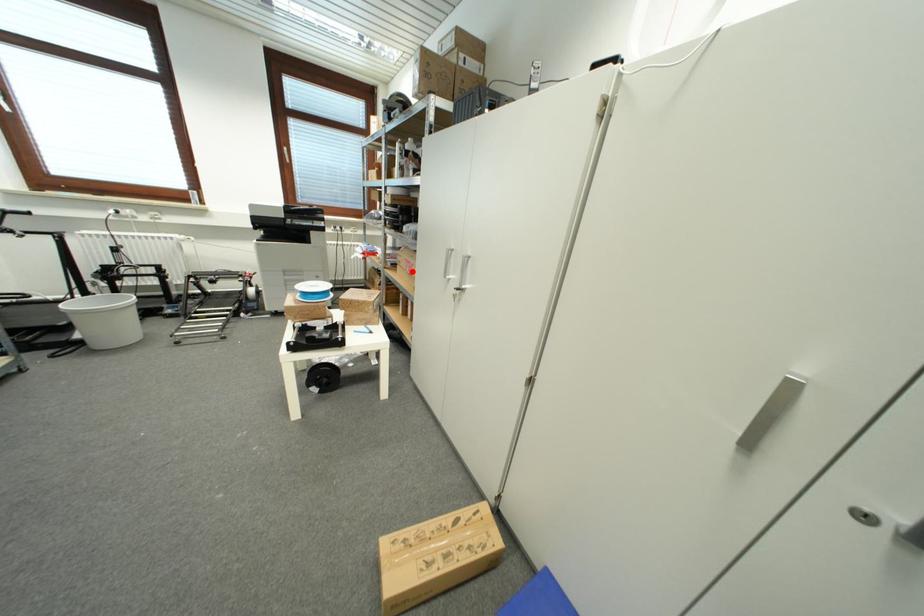
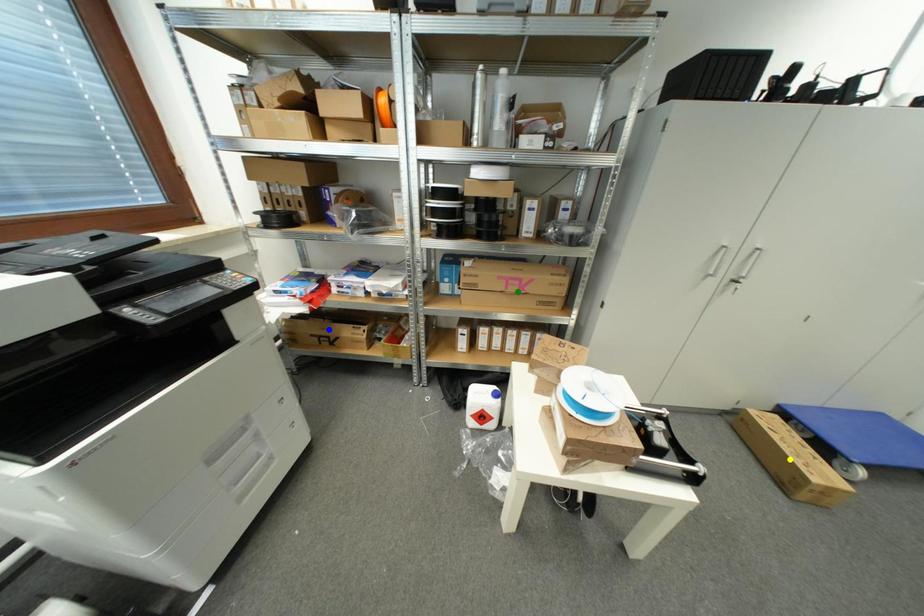
Question: I am providing you with two images of the same scene from different viewpoints. A red point is marked on the first image. You are given multiple points on the second image. Which mark in image 2 goes with the point in image 1?

Choices:
 (A) blue point
 (B) green point
 (C) yellow point

Answer: (B)